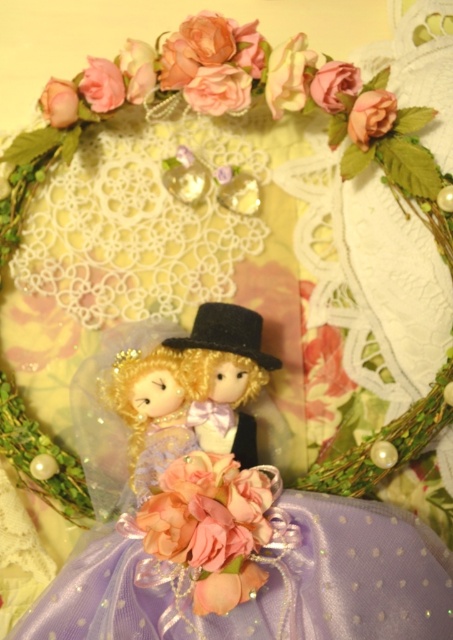
Between lavender satin dress at center and pink satin flower at center, which one has more height?

Standing taller between the two is lavender satin dress at center.

Does lavender satin dress at center have a smaller size compared to pink satin flower at center?

No.

Between point (61, 630) and point (163, 502), which one is positioned in front?

Positioned in front is point (61, 630).

Identify the location of lavender satin dress at center. (269, 584).

Is point (231, 388) in front of point (369, 136)?

Yes, point (231, 388) is closer to viewer.

Measure the distance between satin black top hat at center and matte pink rose at upper center.

satin black top hat at center and matte pink rose at upper center are 46.18 centimeters apart from each other.

Locate an element on the screen. This screenshot has width=453, height=640. satin black top hat at center is located at coordinates (225, 376).

Is point (109, 385) closer to camera compared to point (374, 92)?

That is False.

What do you see at coordinates (149, 412) in the screenshot? I see `matte purple fabric doll at center` at bounding box center [149, 412].

The height and width of the screenshot is (640, 453). Find the location of `matte purple fabric doll at center`. matte purple fabric doll at center is located at coordinates (149, 412).